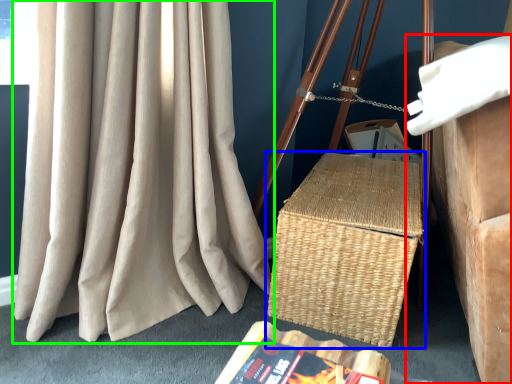
Question: Which object is the farthest from furniture (highlighted by a red box)? Choose among these: picnic basket (highlighted by a blue box) or curtain (highlighted by a green box).

Choices:
 (A) picnic basket
 (B) curtain

Answer: (B)